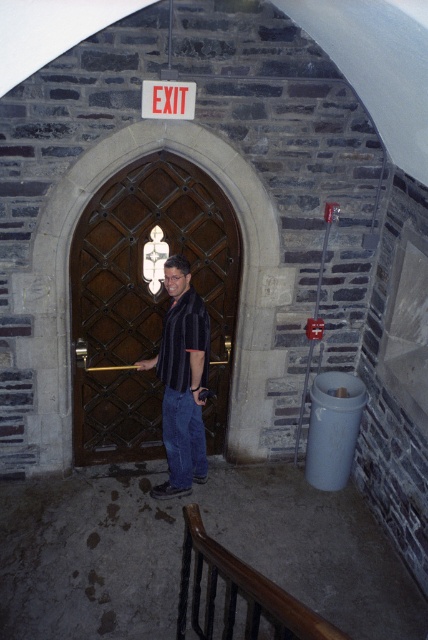
Is point (53, 518) in front of point (269, 584)?

No, it is behind (269, 584).

Is point (171, 636) positioned in front of point (187, 556)?

No, (171, 636) is further to viewer.

The image size is (428, 640). What are the coordinates of `concrete stairs at lower center` in the screenshot? It's located at (181, 554).

Can you confirm if dark wood door at center is taller than black striped shirt at center?

Indeed, dark wood door at center has a greater height compared to black striped shirt at center.

Can you confirm if dark wood door at center is positioned to the right of black striped shirt at center?

In fact, dark wood door at center is to the left of black striped shirt at center.

The height and width of the screenshot is (640, 428). I want to click on dark wood door at center, so click(x=145, y=301).

Does brown polished wood handrail at upper center have a larger size compared to black striped shirt at center?

Yes, brown polished wood handrail at upper center is bigger than black striped shirt at center.

Between point (273, 637) and point (189, 374), which one is positioned behind?

Positioned behind is point (189, 374).

Identify the location of brown polished wood handrail at upper center. The image size is (428, 640). (240, 593).